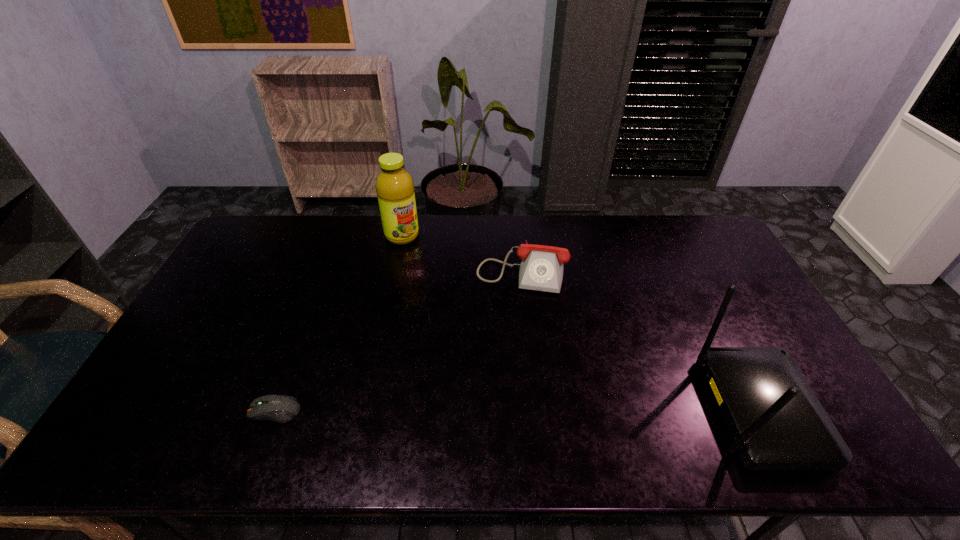
Locate an element on the screen. object situated at the near right corner is located at coordinates (777, 423).

Image resolution: width=960 pixels, height=540 pixels. I want to click on vacant region at the far edge of the desktop, so [564, 224].

Where is `vacant space at the near edge of the desktop`? The width and height of the screenshot is (960, 540). vacant space at the near edge of the desktop is located at coordinates (526, 418).

Locate an element on the screen. The width and height of the screenshot is (960, 540). vacant area at the left edge is located at coordinates (158, 386).

In order to click on vacant area at the right edge in this screenshot , I will do (x=723, y=291).

Find the location of a particular element. free space at the near left corner of the desktop is located at coordinates (197, 410).

Identify the location of vacant area that lies between the third object from right to left and the router. (580, 323).

Image resolution: width=960 pixels, height=540 pixels. In order to click on vacant point located between the shortest object and the third object from right to left in this screenshot , I will do `click(339, 323)`.

You are a GUI agent. You are given a task and a screenshot of the screen. Output one action in this format:
    pyautogui.click(x=<x>, y=<y>)
    Task: Click on the vacant region between the computer equipment and the router
    This screenshot has width=960, height=540.
    Given the screenshot: What is the action you would take?
    point(516,411)

Where is `free space between the second object from left to right and the shortest object`? free space between the second object from left to right and the shortest object is located at coordinates (339, 323).